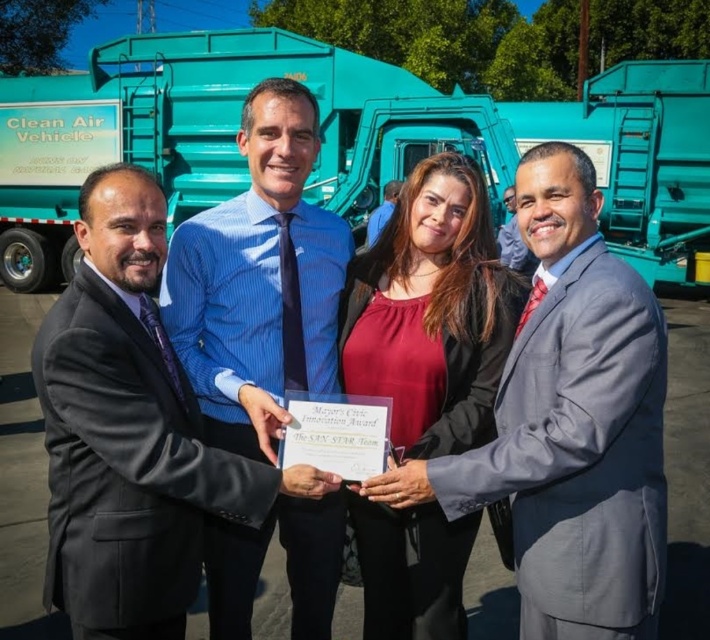
Question: Estimate the real-world distances between objects in this image. Which object is closer to the white paper certificate at center?

Choices:
 (A) matte red blouse at center
 (B) teal matte trailer truck at upper center
 (C) matte blue shirt at center

Answer: (A)

Question: Is white paper certificate at center wider than matte blue shirt at center?

Choices:
 (A) no
 (B) yes

Answer: (A)

Question: Among these objects, which one is farthest from the camera?

Choices:
 (A) matte red blouse at center
 (B) matte blue shirt at center
 (C) teal matte trailer truck at upper center

Answer: (C)

Question: Does matte red blouse at center have a greater width compared to matte blue shirt at center?

Choices:
 (A) yes
 (B) no

Answer: (A)

Question: Can you confirm if white paper certificate at center is positioned above gray suit at center?

Choices:
 (A) yes
 (B) no

Answer: (B)

Question: Which point appears farthest from the camera in this image?

Choices:
 (A) (81, 77)
 (B) (256, 168)
 (C) (368, 225)

Answer: (A)